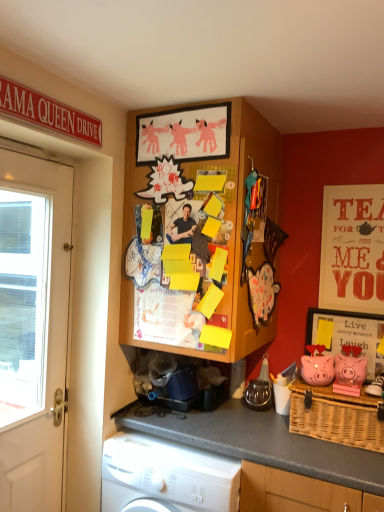
Question: From the image's perspective, is woven wicker picnic basket at lower right located above or below pink matte piggy bank at right, which appears as the first pig when viewed from the right?

Choices:
 (A) above
 (B) below

Answer: (B)

Question: In terms of width, does woven wicker picnic basket at lower right look wider or thinner when compared to pink matte piggy bank at right, which appears as the first pig when viewed from the right?

Choices:
 (A) wide
 (B) thin

Answer: (A)

Question: Which of these objects is positioned farthest from the wooden framed picture at right, positioned as the first picture frame in right-to-left order?

Choices:
 (A) matte red poster at upper right
 (B) wooden board at upper center
 (C) woven wicker picnic basket at lower right
 (D) matte pink paper at upper center, which is the second picture frame from back to front
 (E) white plastic washing machine at lower left

Answer: (D)

Question: Which object is the closest to the white plastic washing machine at lower left?

Choices:
 (A) wooden board at upper center
 (B) pink matte piggy bank at right, which appears as the first pig when viewed from the right
 (C) metallic silver kettle at center
 (D) matte pink paper at upper center, acting as the 1th picture frame starting from the top
 (E) white wooden door at left

Answer: (E)